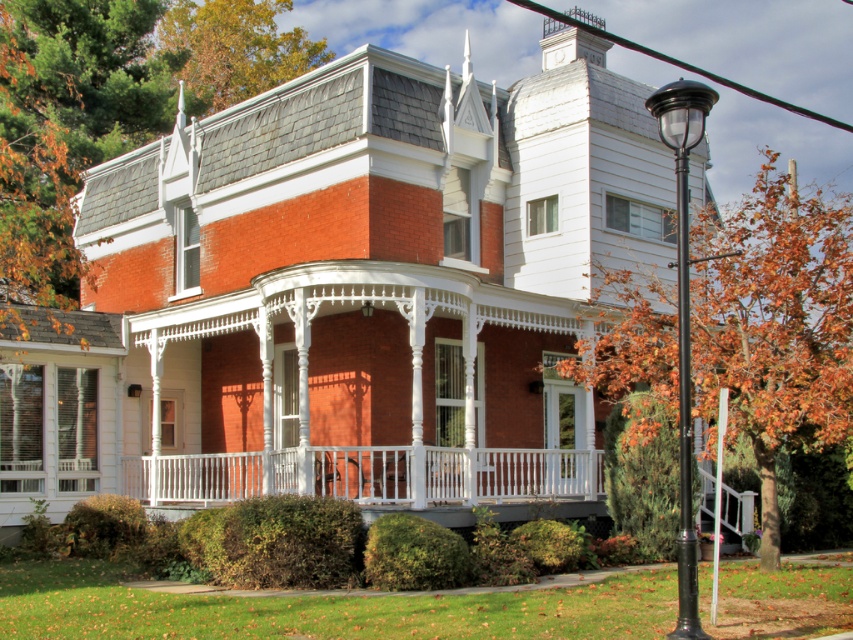
Question: Can you confirm if white painted wood porch at center is positioned below black polished metal lamp post at right?

Choices:
 (A) yes
 (B) no

Answer: (A)

Question: Which point is farther to the camera?

Choices:
 (A) (679, 108)
 (B) (129, 484)

Answer: (B)

Question: Which of the following is the farthest from the observer?

Choices:
 (A) (683, 504)
 (B) (244, 496)

Answer: (B)

Question: Does white painted wood porch at center lie behind black polished metal lamp post at right?

Choices:
 (A) no
 (B) yes

Answer: (B)

Question: Does white painted wood porch at center have a larger size compared to black polished metal lamp post at right?

Choices:
 (A) no
 (B) yes

Answer: (A)

Question: Which object is farther from the camera taking this photo?

Choices:
 (A) black polished metal lamp post at right
 (B) white painted wood porch at center

Answer: (B)